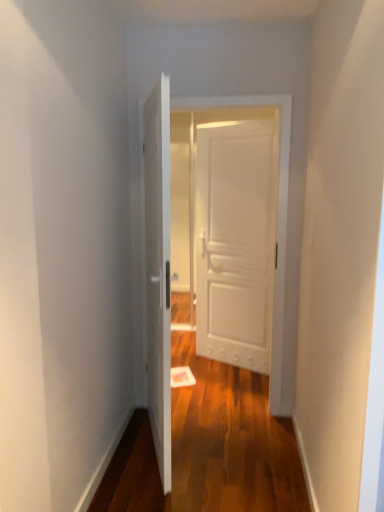
You are a GUI agent. You are given a task and a screenshot of the screen. Output one action in this format:
    pyautogui.click(x=<x>, y=<y>)
    Task: Click on the blank space above white wooden door at center, which appears as the 2th door when viewed from the front (from a real-world perspective)
    
    Given the screenshot: What is the action you would take?
    pyautogui.click(x=214, y=94)